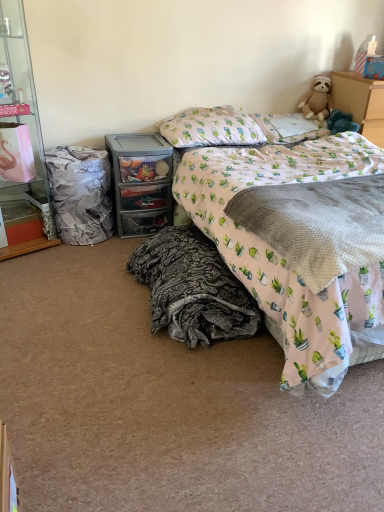
Identify the location of free space between clear glass cabinet at left and dark gray textured blanket at lower center, the second blanket viewed from the right. Image resolution: width=384 pixels, height=512 pixels. (85, 280).